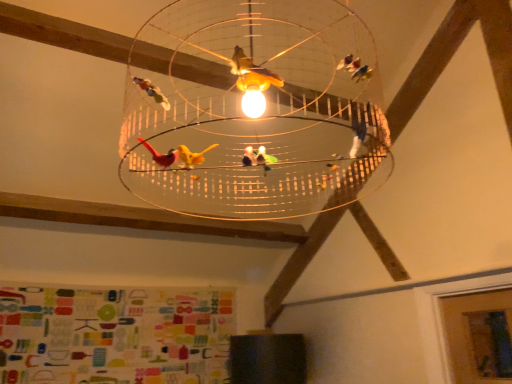
Identify the location of translucent glass lamp at center. (252, 106).

Image resolution: width=512 pixels, height=384 pixels. Describe the element at coordinates (252, 106) in the screenshot. I see `translucent glass lamp at center` at that location.

Find the location of a particular element. translucent glass lamp at center is located at coordinates (252, 106).